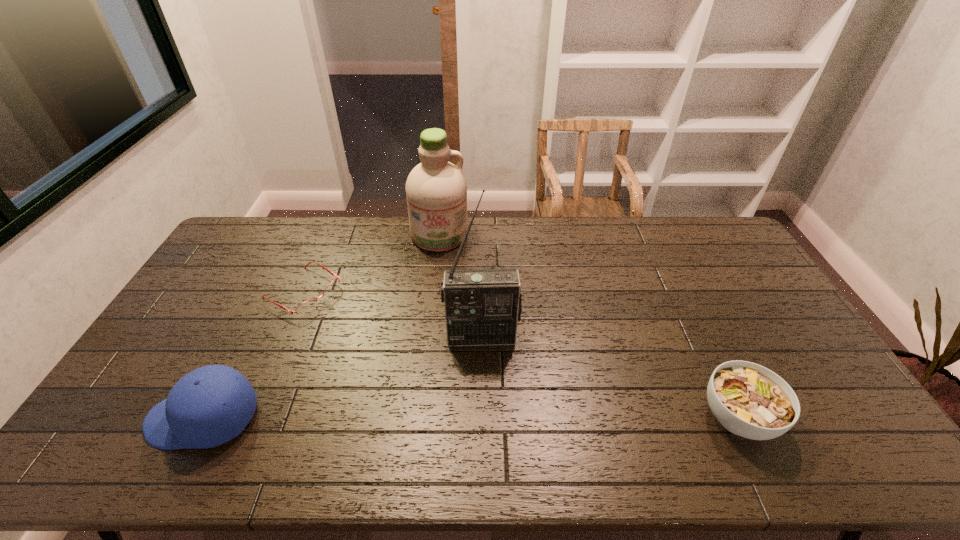
Identify the location of object present at the far edge. The height and width of the screenshot is (540, 960). (436, 190).

You are a GUI agent. You are given a task and a screenshot of the screen. Output one action in this format:
    pyautogui.click(x=<x>, y=<y>)
    Task: Click on the cap that is at the near edge
    
    Given the screenshot: What is the action you would take?
    pyautogui.click(x=209, y=406)

Identify the location of soup bowl situated at the near edge. This screenshot has width=960, height=540. (749, 400).

This screenshot has width=960, height=540. Find the location of `object present at the left edge`. object present at the left edge is located at coordinates (209, 406).

Locate an element on the screen. object located at the near left corner is located at coordinates (209, 406).

In the image, there is a desktop. Where is `vacant space at the far edge`? This screenshot has height=540, width=960. vacant space at the far edge is located at coordinates click(531, 244).

Locate an element on the screen. vacant region at the near edge of the desktop is located at coordinates (505, 401).

I want to click on free space at the left edge of the desktop, so click(x=244, y=266).

Identify the location of vacant area at the right edge. (755, 335).

This screenshot has height=540, width=960. Identify the location of vacant space at the far right corner of the desktop. (715, 249).